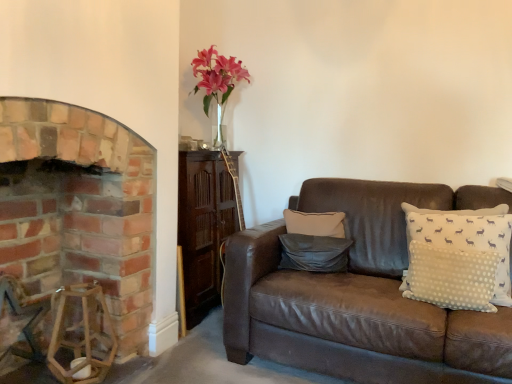
What is the approximate height of pink glass vase at upper center?

62.80 centimeters.

What is the approximate width of white dotted pillow at right, which is counted as the second pillow, starting from the left?

It is 6.68 inches.

What is the approximate height of white dotted pillow at right, placed as the 1th pillow when sorted from right to left?

It is 22.29 inches.

Where is `dark gray leather pillow at center, which is the 1th pillow in left-to-right order`? The width and height of the screenshot is (512, 384). dark gray leather pillow at center, which is the 1th pillow in left-to-right order is located at coordinates (314, 253).

Can you tell me how much pink glass vase at upper center and brick fireplace at left differ in facing direction?

The facing directions of pink glass vase at upper center and brick fireplace at left are 0.0976 degrees apart.

Is brick fireplace at left completely or partially inside pink glass vase at upper center?

No, brick fireplace at left is not surrounded by pink glass vase at upper center.

Locate an element on the screen. fireplace located underneath the pink glass vase at upper center (from a real-world perspective) is located at coordinates (79, 208).

From a real-world perspective, is pink glass vase at upper center physically below brick fireplace at left?

Incorrect, from a real-world perspective, pink glass vase at upper center is higher than brick fireplace at left.

From a real-world perspective, is brick fireplace at left above or below pink glass vase at upper center?

From a real-world perspective, brick fireplace at left is physically below pink glass vase at upper center.

Which object is wider, brick fireplace at left or pink glass vase at upper center?

brick fireplace at left is wider.

Which is farther from the camera, (x=88, y=129) or (x=231, y=86)?

The point (x=231, y=86) is behind.

Is brick fireplace at left oriented towards pink glass vase at upper center?

No, brick fireplace at left is not facing towards pink glass vase at upper center.

Could dark gray leather pillow at center, which is the 1th pillow in left-to-right order, be considered to be inside brick fireplace at left?

No, brick fireplace at left does not contain dark gray leather pillow at center, which is the 1th pillow in left-to-right order.

In the image, is brick fireplace at left positioned in front of or behind dark gray leather pillow at center, which is the 1th pillow in left-to-right order?

In the image, brick fireplace at left appears in front of dark gray leather pillow at center, which is the 1th pillow in left-to-right order.

The height and width of the screenshot is (384, 512). In order to click on fireplace above the dark gray leather pillow at center, which is the 1th pillow in left-to-right order (from the image's perspective) in this screenshot , I will do `click(79, 208)`.

Does brick fireplace at left turn towards dark gray leather pillow at center, which appears as the 2th pillow when viewed from the right?

No, brick fireplace at left is not facing towards dark gray leather pillow at center, which appears as the 2th pillow when viewed from the right.

From the picture: Is the surface of white dotted pillow at right, placed as the 1th pillow when sorted from right to left, in direct contact with brick fireplace at left?

No, white dotted pillow at right, placed as the 1th pillow when sorted from right to left, is not in contact with brick fireplace at left.

Is white dotted pillow at right, which is counted as the second pillow, starting from the left, not inside brick fireplace at left?

Indeed, white dotted pillow at right, which is counted as the second pillow, starting from the left, is completely outside brick fireplace at left.

From the image's perspective, relative to brick fireplace at left, is white dotted pillow at right, which is counted as the second pillow, starting from the left, above or below?

Clearly, from the image's perspective, white dotted pillow at right, which is counted as the second pillow, starting from the left, is above brick fireplace at left.

Is dark gray leather pillow at center, which is the 1th pillow in left-to-right order, looking in the opposite direction of brick fireplace at left?

No.

Looking at this image, from a real-world perspective, is dark gray leather pillow at center, which appears as the 2th pillow when viewed from the right, positioned under brick fireplace at left based on gravity?

Correct, in the physical world, dark gray leather pillow at center, which appears as the 2th pillow when viewed from the right, is lower than brick fireplace at left.

Is dark gray leather pillow at center, which appears as the 2th pillow when viewed from the right, taller than brick fireplace at left?

Incorrect, the height of dark gray leather pillow at center, which appears as the 2th pillow when viewed from the right, is not larger of that of brick fireplace at left.

From the image's perspective, is dark gray leather pillow at center, which is the 1th pillow in left-to-right order, on top of white dotted pillow at right, which is counted as the second pillow, starting from the left?

A: No, from the image's perspective, dark gray leather pillow at center, which is the 1th pillow in left-to-right order, is not above white dotted pillow at right, which is counted as the second pillow, starting from the left.

How different are the orientations of dark gray leather pillow at center, which appears as the 2th pillow when viewed from the right, and white dotted pillow at right, which is counted as the second pillow, starting from the left, in degrees?

17.3 degrees separate the facing orientations of dark gray leather pillow at center, which appears as the 2th pillow when viewed from the right, and white dotted pillow at right, which is counted as the second pillow, starting from the left.

From a real-world perspective, between dark gray leather pillow at center, which appears as the 2th pillow when viewed from the right, and white dotted pillow at right, placed as the 1th pillow when sorted from right to left, who is vertically lower?

dark gray leather pillow at center, which appears as the 2th pillow when viewed from the right, is physically lower.

Looking at the image, does dark gray leather pillow at center, which appears as the 2th pillow when viewed from the right, seem bigger or smaller compared to white dotted pillow at right, placed as the 1th pillow when sorted from right to left?

dark gray leather pillow at center, which appears as the 2th pillow when viewed from the right, is smaller than white dotted pillow at right, placed as the 1th pillow when sorted from right to left.

Is white dotted pillow at right, which is counted as the second pillow, starting from the left, wider or thinner than pink glass vase at upper center?

Considering their sizes, white dotted pillow at right, which is counted as the second pillow, starting from the left, looks slimmer than pink glass vase at upper center.

Which is more to the left, white dotted pillow at right, which is counted as the second pillow, starting from the left, or pink glass vase at upper center?

pink glass vase at upper center.

Considering the positions of points (465, 233) and (216, 73), is point (465, 233) farther from camera compared to point (216, 73)?

No, (465, 233) is in front of (216, 73).

Where is `fireplace located on the left of pink glass vase at upper center`? The image size is (512, 384). fireplace located on the left of pink glass vase at upper center is located at coordinates [79, 208].

At what (x,y) coordinates should I click in order to perform the action: click on floral arrangement above the brick fireplace at left (from a real-world perspective). Please return your answer as a coordinate pair (x, y). The image size is (512, 384). Looking at the image, I should click on (217, 83).

When comparing their distances from pink glass vase at upper center, does dark gray leather pillow at center, which is the 1th pillow in left-to-right order, or white dotted pillow at right, which is counted as the second pillow, starting from the left, seem closer?

dark gray leather pillow at center, which is the 1th pillow in left-to-right order, lies closer to pink glass vase at upper center than the other object.

Which object lies nearer to the anchor point pink glass vase at upper center, white dotted pillow at right, placed as the 1th pillow when sorted from right to left, or dark gray leather pillow at center, which appears as the 2th pillow when viewed from the right?

Based on the image, dark gray leather pillow at center, which appears as the 2th pillow when viewed from the right, appears to be nearer to pink glass vase at upper center.

Based on their spatial positions, is brick fireplace at left or white dotted pillow at right, placed as the 1th pillow when sorted from right to left, further from pink glass vase at upper center?

white dotted pillow at right, placed as the 1th pillow when sorted from right to left, lies further to pink glass vase at upper center than the other object.

From the picture: Considering their positions, is dark gray leather pillow at center, which appears as the 2th pillow when viewed from the right, positioned closer to pink glass vase at upper center than brick fireplace at left?

Based on the image, dark gray leather pillow at center, which appears as the 2th pillow when viewed from the right, appears to be nearer to pink glass vase at upper center.

Which object lies nearer to the anchor point white dotted pillow at right, which is counted as the second pillow, starting from the left, dark gray leather pillow at center, which is the 1th pillow in left-to-right order, or brick fireplace at left?

dark gray leather pillow at center, which is the 1th pillow in left-to-right order, is closer to white dotted pillow at right, which is counted as the second pillow, starting from the left.

Looking at the image, which one is located further to brick fireplace at left, pink glass vase at upper center or white dotted pillow at right, which is counted as the second pillow, starting from the left?

Among the two, white dotted pillow at right, which is counted as the second pillow, starting from the left, is located further to brick fireplace at left.

Looking at the image, which one is located closer to white dotted pillow at right, placed as the 1th pillow when sorted from right to left, brick fireplace at left or dark gray leather pillow at center, which is the 1th pillow in left-to-right order?

dark gray leather pillow at center, which is the 1th pillow in left-to-right order, is positioned closer to the anchor white dotted pillow at right, placed as the 1th pillow when sorted from right to left.

Looking at the image, which one is located closer to brick fireplace at left, white dotted pillow at right, which is counted as the second pillow, starting from the left, or dark gray leather pillow at center, which appears as the 2th pillow when viewed from the right?

dark gray leather pillow at center, which appears as the 2th pillow when viewed from the right, lies closer to brick fireplace at left than the other object.

The height and width of the screenshot is (384, 512). What are the coordinates of `floral arrangement between brick fireplace at left and white dotted pillow at right, placed as the 1th pillow when sorted from right to left, in the horizontal direction` in the screenshot? It's located at (217, 83).

At what (x,y) coordinates should I click in order to perform the action: click on pillow between pink glass vase at upper center and white dotted pillow at right, placed as the 1th pillow when sorted from right to left, from left to right. Please return your answer as a coordinate pair (x, y). This screenshot has width=512, height=384. Looking at the image, I should click on (314, 253).

Find the location of a particular element. The height and width of the screenshot is (384, 512). pillow situated between brick fireplace at left and white dotted pillow at right, placed as the 1th pillow when sorted from right to left, from left to right is located at coordinates (314, 253).